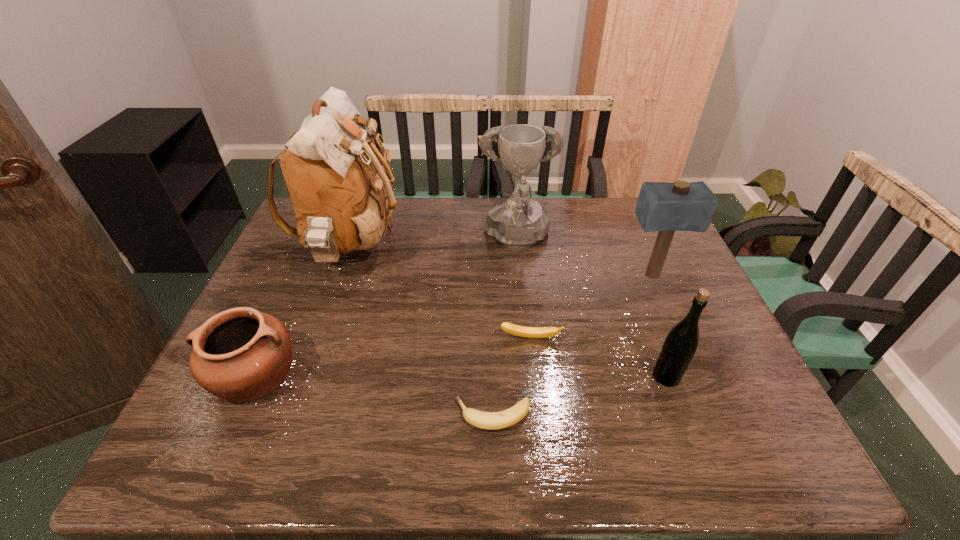
This screenshot has height=540, width=960. Identify the location of unoccupied position between the tallest object and the third shortest object. (303, 312).

Find the location of a particular element. This screenshot has height=540, width=960. vacant area that lies between the award and the second shortest object is located at coordinates (523, 289).

You are a GUI agent. You are given a task and a screenshot of the screen. Output one action in this format:
    pyautogui.click(x=<x>, y=<y>)
    Task: Click on the vacant region between the award and the pottery
    This screenshot has height=540, width=960.
    Given the screenshot: What is the action you would take?
    pyautogui.click(x=386, y=307)

Where is `free spot between the mallet and the sixth shortest object`? This screenshot has height=540, width=960. free spot between the mallet and the sixth shortest object is located at coordinates (584, 258).

The image size is (960, 540). Find the location of `free space between the third shortest object and the beer bottle`. free space between the third shortest object and the beer bottle is located at coordinates (461, 375).

Image resolution: width=960 pixels, height=540 pixels. Identify the location of free point between the backpack and the nearer banana. (422, 332).

The height and width of the screenshot is (540, 960). Identify the location of vacant area that lies between the third shortest object and the backpack. (303, 312).

Image resolution: width=960 pixels, height=540 pixels. Find the location of `vacant space that is in between the farther banana and the mallet`. vacant space that is in between the farther banana and the mallet is located at coordinates (590, 307).

In order to click on empty space between the farther banana and the pottery in this screenshot , I will do `click(393, 356)`.

You are a GUI agent. You are given a task and a screenshot of the screen. Output one action in this format:
    pyautogui.click(x=<x>, y=<y>)
    Task: Click on the object that is the fifth closest one to the taller banana
    The height and width of the screenshot is (540, 960).
    Given the screenshot: What is the action you would take?
    pyautogui.click(x=342, y=196)